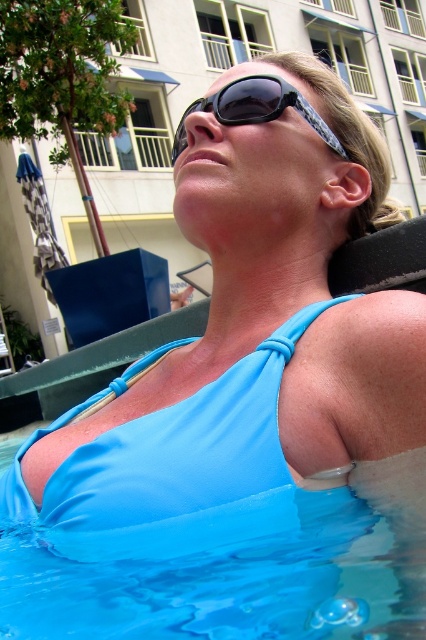
What do you see at coordinates (169, 445) in the screenshot? I see `matte blue bikini top at upper center` at bounding box center [169, 445].

Locate an element on the screen. matte blue bikini top at upper center is located at coordinates (169, 445).

The width and height of the screenshot is (426, 640). Identify the location of matte blue bikini top at upper center. pyautogui.click(x=169, y=445).

Between point (423, 550) and point (196, 99), which one is positioned in front?

Point (423, 550)

Is point (360, 496) behind point (239, 122)?

No, it is not.

The width and height of the screenshot is (426, 640). What are the coordinates of `transparent blue water at lower center` in the screenshot? It's located at (233, 572).

Where is `transparent blue water at lower center`? transparent blue water at lower center is located at coordinates (233, 572).

Is transparent blue water at lower center closer to camera compared to matte blue bikini top at upper center?

Yes, it is.

Does point (359, 531) lie in front of point (51, 476)?

Yes, point (359, 531) is closer to viewer.

Locate an element on the screen. This screenshot has width=426, height=640. transparent blue water at lower center is located at coordinates (233, 572).